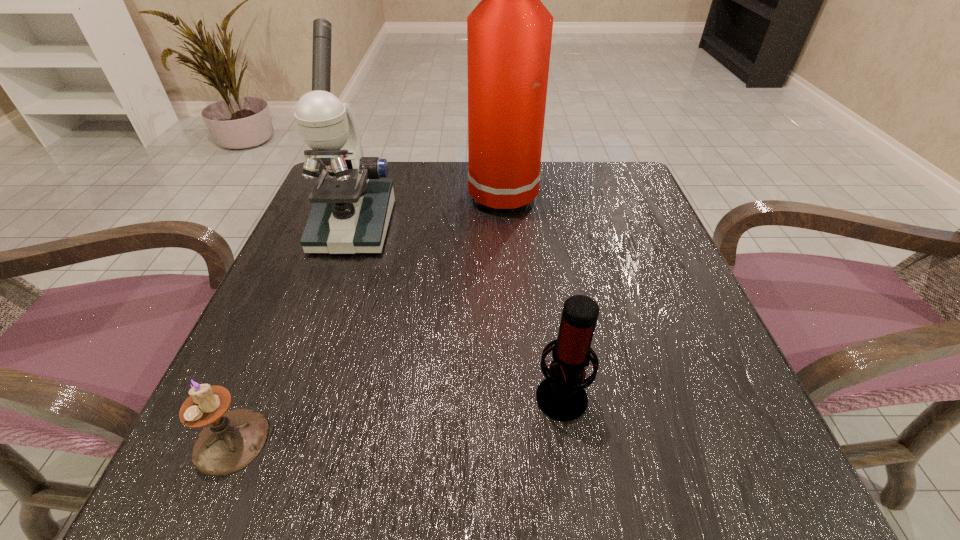
You are a GUI agent. You are given a task and a screenshot of the screen. Output one action in this format:
    pyautogui.click(x=<x>, y=<y>)
    Task: Click on the fire extinguisher
    This screenshot has height=540, width=960.
    Given the screenshot: What is the action you would take?
    pyautogui.click(x=509, y=33)

This screenshot has width=960, height=540. I want to click on the third shortest object, so click(352, 206).

Find the location of a particular element. This screenshot has width=960, height=540. the third tallest object is located at coordinates (562, 397).

Find the location of `candle holder`. candle holder is located at coordinates (231, 440).

I want to click on free space located 0.330m at the nozzle of the fire extinguisher, so click(x=323, y=196).

Find the location of a particular element. Image resolution: width=960 pixels, height=540 pixels. vacant space located 0.140m at the nozzle of the fire extinguisher is located at coordinates (406, 196).

You are a GUI agent. You are given a task and a screenshot of the screen. Output one action in this format:
    pyautogui.click(x=<x>, y=<y>)
    Task: Click on the vacant area situated 0.070m at the nozzle of the fire extinguisher
    The height and width of the screenshot is (540, 960).
    Given the screenshot: What is the action you would take?
    pyautogui.click(x=437, y=196)

Where is `vacant space located 0.240m on the right of the third shortest object`? The height and width of the screenshot is (540, 960). vacant space located 0.240m on the right of the third shortest object is located at coordinates (506, 226).

The image size is (960, 540). What are the coordinates of `blank area located 0.380m on the left of the third tallest object` in the screenshot? It's located at (268, 394).

At what (x,y) coordinates should I click in order to perform the action: click on free location located on the back of the shortest object. Please return your answer as a coordinate pair (x, y). The width and height of the screenshot is (960, 540). Looking at the image, I should click on (307, 265).